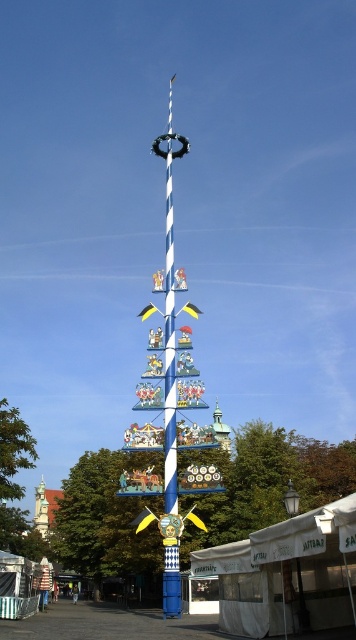
Question: Which of the following is the farthest from the observer?

Choices:
 (A) white canvas tent at lower right
 (B) smooth stone tower at lower left

Answer: (B)

Question: Can you confirm if white canvas tent at lower right is bigger than smooth stone tower at lower left?

Choices:
 (A) no
 (B) yes

Answer: (B)

Question: Is white canvas tent at lower right positioned before smooth stone tower at lower left?

Choices:
 (A) yes
 (B) no

Answer: (A)

Question: Which of the following is the farthest from the observer?

Choices:
 (A) white canvas tent at lower right
 (B) smooth stone tower at lower left

Answer: (B)

Question: Which of the following is the closest to the observer?

Choices:
 (A) smooth stone tower at lower left
 (B) white canvas tent at lower right

Answer: (B)

Question: Can you confirm if white canvas tent at lower right is positioned above smooth stone tower at lower left?

Choices:
 (A) yes
 (B) no

Answer: (A)